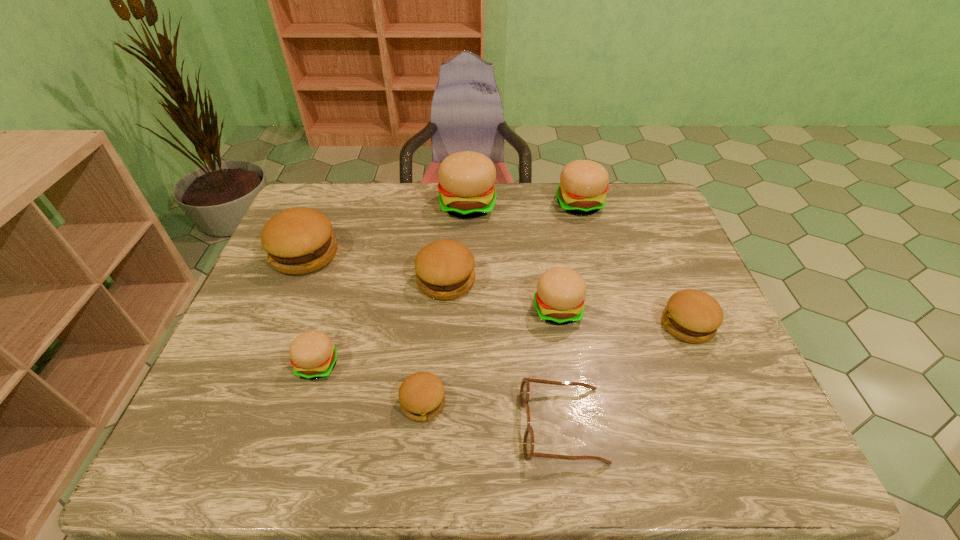
The height and width of the screenshot is (540, 960). In order to click on free space in the image that satisfies the following two spatial constraints: 1. on the front side of the biggest brown hamburger; 2. on the left side of the smallest beige hamburger in this screenshot , I will do [x=259, y=364].